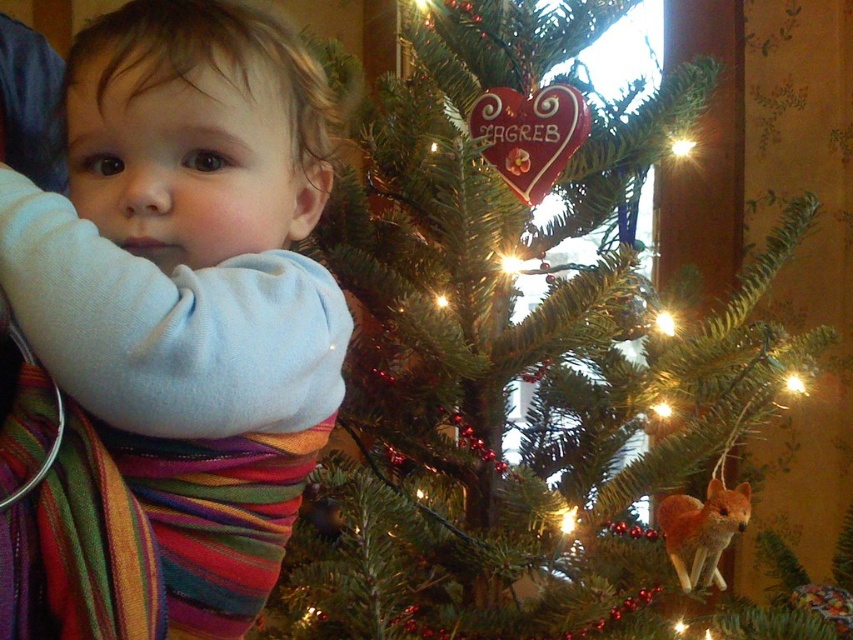
You are a photographer setting up a shot of the green matte christmas tree at center and the white soft baby at center. To ensure both are in frame, should you position yourself to the left or right of the scene?

You should position yourself to the left of the scene because the green matte christmas tree at center is to the right of the white soft baby at center, so placing yourself to the left will keep both in frame.

You are a photographer trying to capture a photo of both the green matte christmas tree at center and the white soft baby at center. Which object should you focus on first if you want to ensure both are in the frame without moving the camera?

The green matte christmas tree at center is wider than the white soft baby at center, so you should focus on the green matte christmas tree at center first to ensure it fits entirely within the frame. Once it is centered, the smaller white soft baby at center will also be included.

You are a drone operator trying to capture a photo of the green matte christmas tree at center. The camera is positioned at point A. The point A is located at coordinates (508, 356). Is the green matte christmas tree at center visible from point A?

The point A at coordinates (508, 356) indicates the green matte christmas tree at center, so yes, the tree is visible from that point as it is the exact location of the tree.